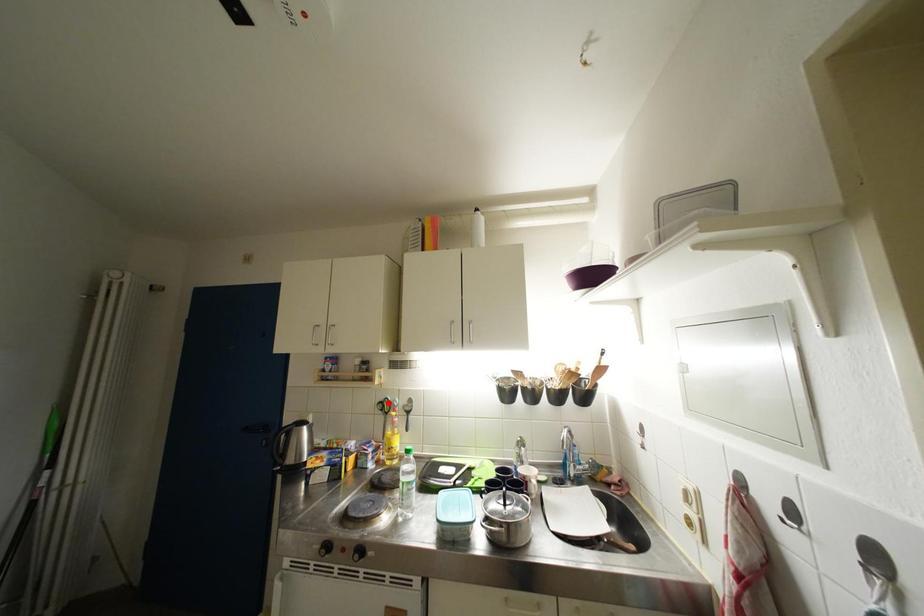
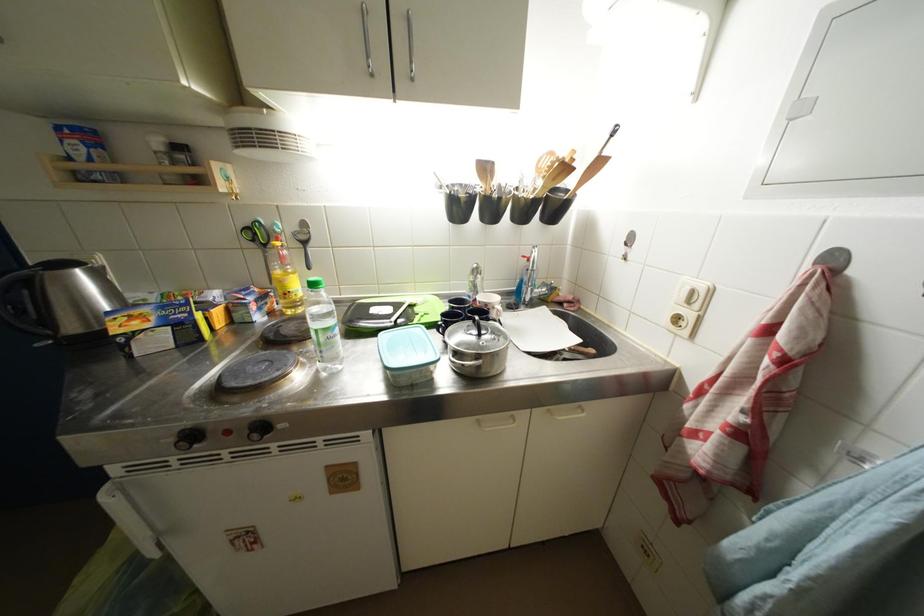
Question: I am providing you with two images of the same scene from different viewpoints. Given a red point in image1, look at the same physical point in image2. Is it:

Choices:
 (A) Closer to the viewpoint
 (B) Farther from the viewpoint

Answer: (A)